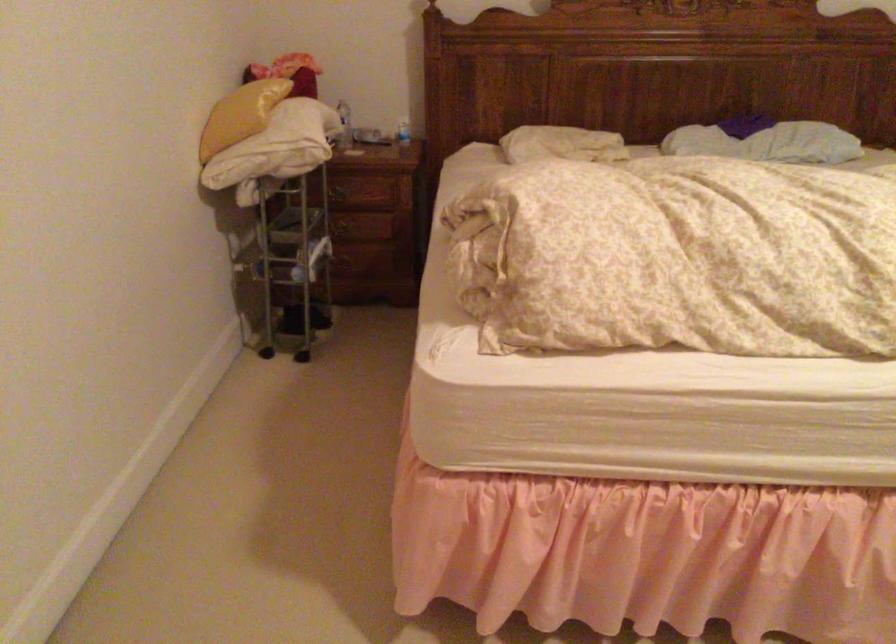
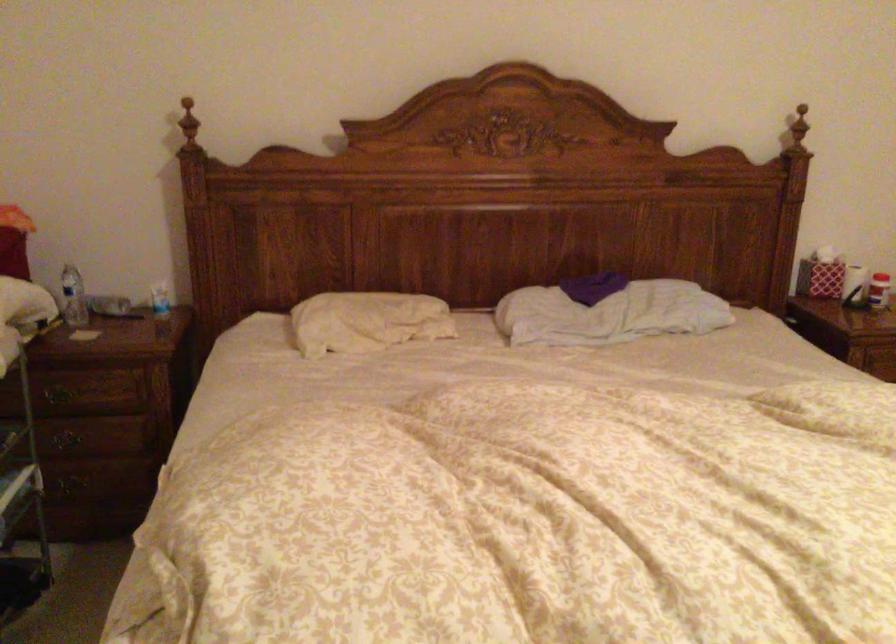
Question: The first image is from the beginning of the video and the second image is from the end. How did the camera likely rotate when shooting the video?

Choices:
 (A) Left
 (B) Right
 (C) Up
 (D) Down

Answer: (B)